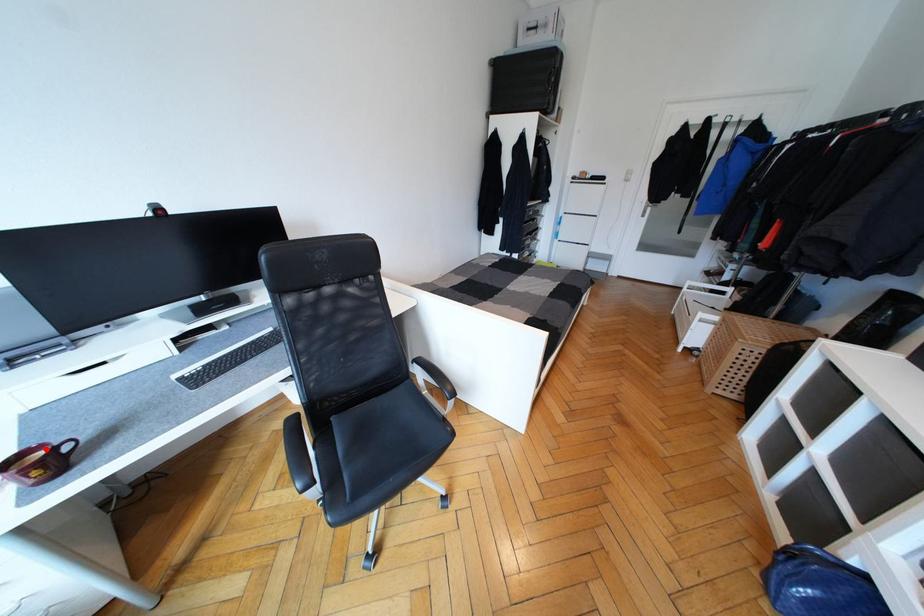
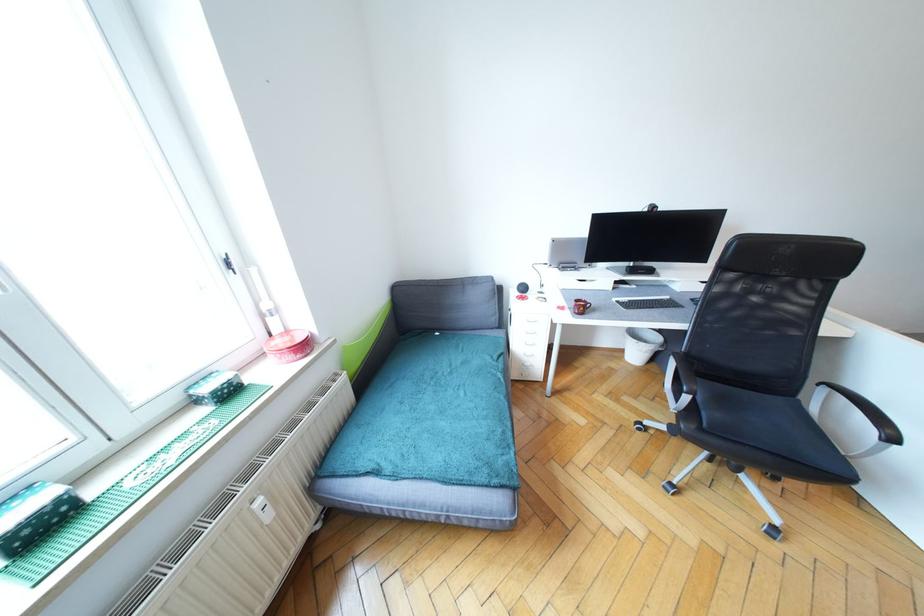
The point at the highlighted location is marked in the first image. Where is the corresponding point in the second image?

(589, 302)